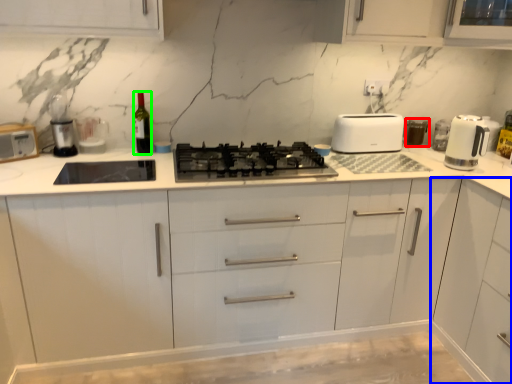
Question: Estimate the real-world distances between objects in this image. Which object is farther from appliance (highlighted by a red box), cabinetry (highlighted by a blue box) or wine bottle (highlighted by a green box)?

Choices:
 (A) cabinetry
 (B) wine bottle

Answer: (B)